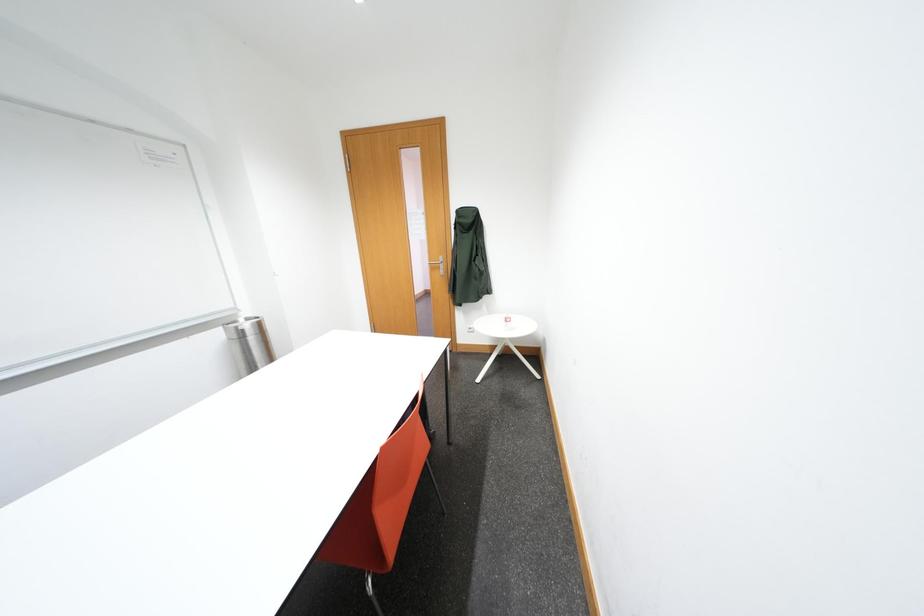
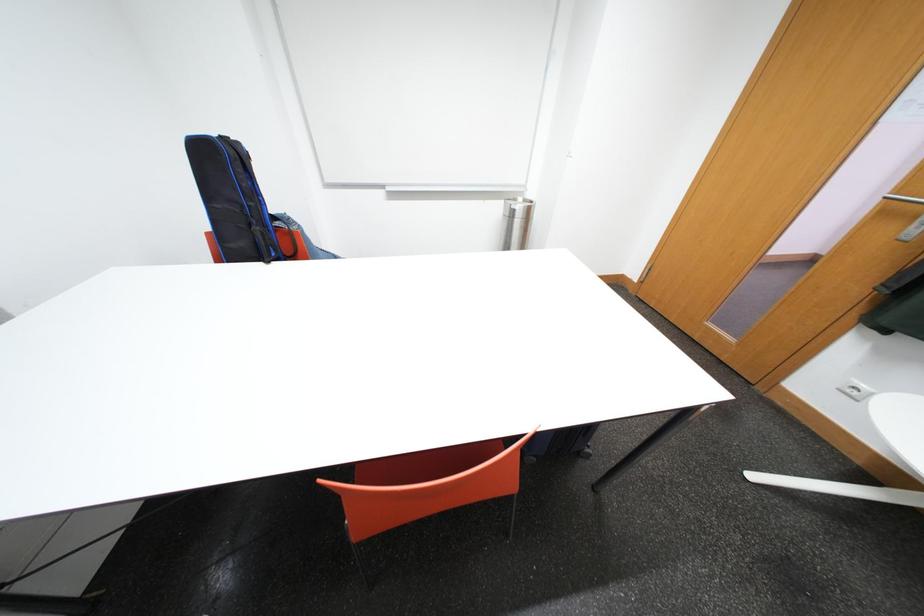
The images are taken continuously from a first-person perspective. In which direction is your viewpoint rotating?

The camera rotated toward left-down.